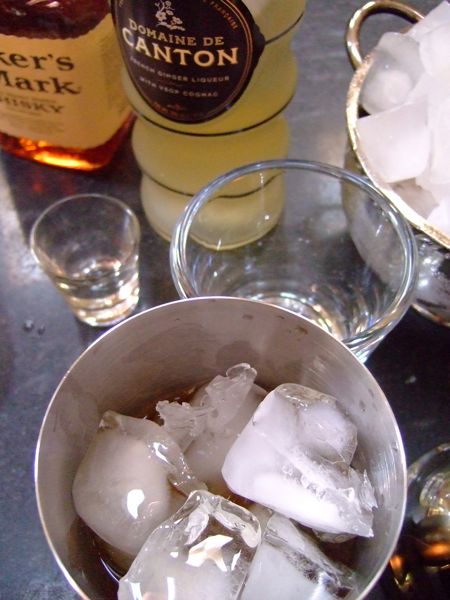
I want to click on ginger liquor bottle, so click(x=185, y=161).